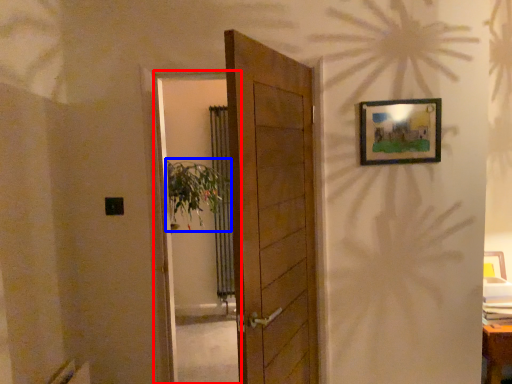
Question: Which object is closer to the camera taking this photo, screen door (highlighted by a red box) or plant (highlighted by a blue box)?

Choices:
 (A) screen door
 (B) plant

Answer: (A)